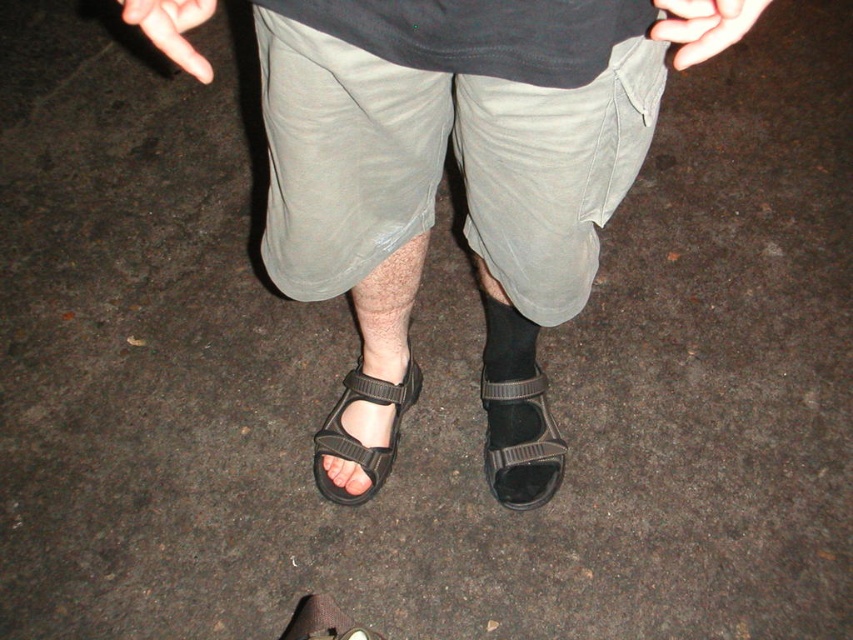
Question: Among these objects, which one is nearest to the camera?

Choices:
 (A) black rubber sandals at center
 (B) matte black toe at center
 (C) black synthetic sandal at lower left

Answer: (A)

Question: In this image, where is light gray cotton shorts at center located relative to matte black toe at center?

Choices:
 (A) below
 (B) above

Answer: (B)

Question: Which object appears closest to the camera in this image?

Choices:
 (A) black rubber sandals at center
 (B) black rubber sandal at lower center

Answer: (A)

Question: Considering the relative positions of black rubber sandal at lower center and flesh-toned skin at lower left in the image provided, where is black rubber sandal at lower center located with respect to flesh-toned skin at lower left?

Choices:
 (A) below
 (B) above

Answer: (A)

Question: Can you confirm if black rubber sandals at center is positioned below black rubber sandal at lower center?

Choices:
 (A) no
 (B) yes

Answer: (A)

Question: Among these objects, which one is farthest from the camera?

Choices:
 (A) black rubber sandal at lower center
 (B) black synthetic sandal at lower left
 (C) smooth skin hand at upper right

Answer: (B)